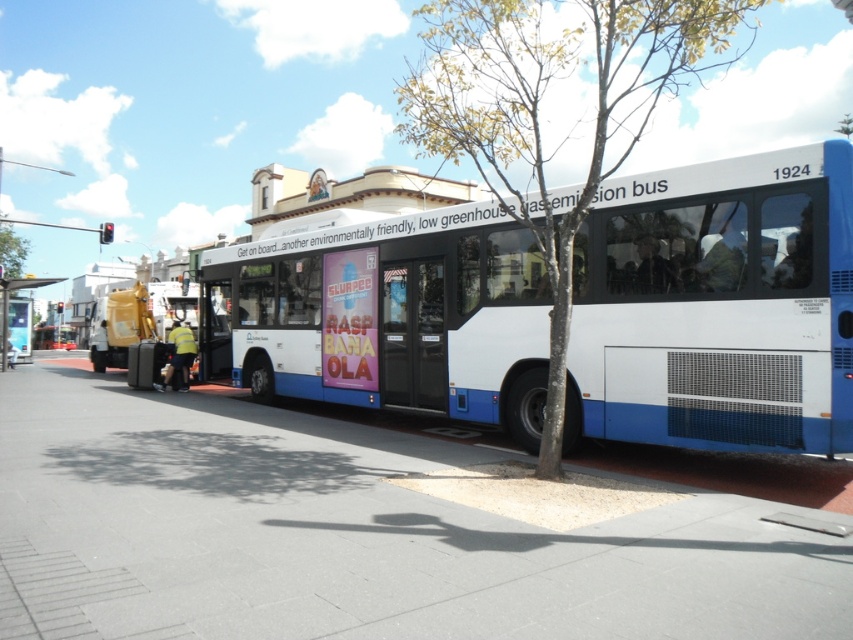
You are a pedestrian standing on the gray concrete pavement at center and want to reach the metallic bus stop at left. Which direction should you move to get closer to the bus stop?

Since the gray concrete pavement at center is closer to the viewer than the metallic bus stop at left, you should move forward towards the bus stop as it is ahead of your current position.

You are standing at the bus stop and want to walk to the gray concrete pavement at center. Which direction should you move relative to the bus?

The gray concrete pavement at center is located at point (352, 536), so you should move towards the center of the image where the coordinates are located relative to the bus.